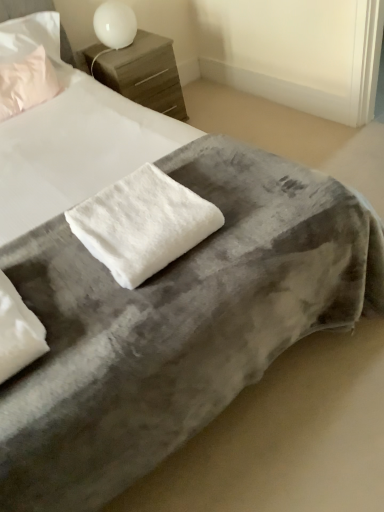
The width and height of the screenshot is (384, 512). Identify the location of vacant area on top of white fluffy towel at center (from a real-world perspective). (160, 201).